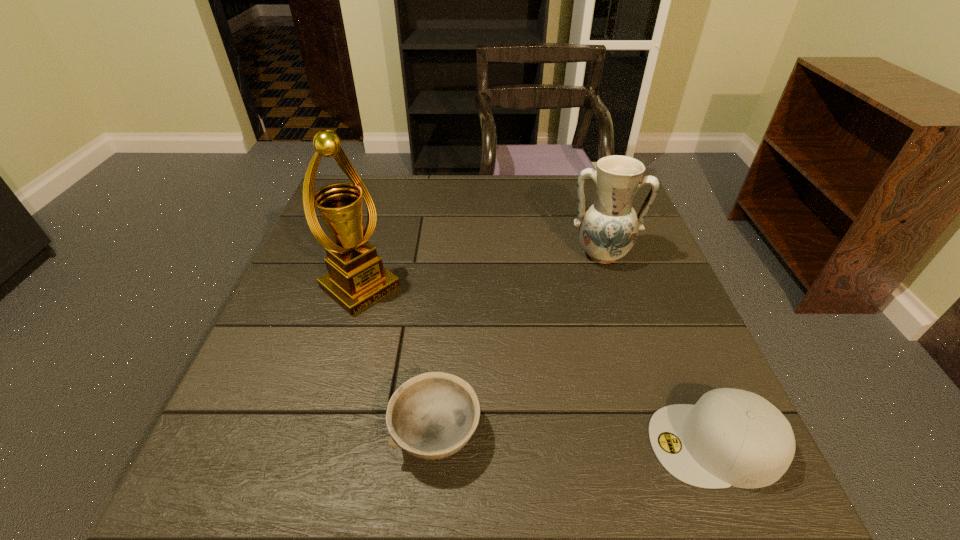
Where is `pottery that is positioned at the right edge`? pottery that is positioned at the right edge is located at coordinates (608, 227).

This screenshot has height=540, width=960. Find the location of `object present at the near right corner`. object present at the near right corner is located at coordinates (731, 437).

Where is `free space at the far edge of the desktop`? The height and width of the screenshot is (540, 960). free space at the far edge of the desktop is located at coordinates (516, 201).

The image size is (960, 540). I want to click on vacant space at the left edge of the desktop, so click(316, 376).

At what (x,y) coordinates should I click in order to perform the action: click on vacant space at the right edge. Please return your answer as a coordinate pair (x, y). The height and width of the screenshot is (540, 960). Looking at the image, I should click on (654, 292).

Image resolution: width=960 pixels, height=540 pixels. In order to click on vacant space at the near left corner of the desktop in this screenshot , I will do `click(300, 423)`.

In order to click on unoccupied position between the second object from left to right and the tallest object in this screenshot , I will do `click(398, 361)`.

This screenshot has width=960, height=540. What are the coordinates of `free area in between the cap and the second object from left to right` in the screenshot? It's located at (576, 438).

The height and width of the screenshot is (540, 960). What are the coordinates of `empty space between the pottery and the leftmost object` in the screenshot? It's located at click(x=481, y=271).

Identify the location of vacant space that's between the award and the second shortest object. This screenshot has width=960, height=540. (538, 366).